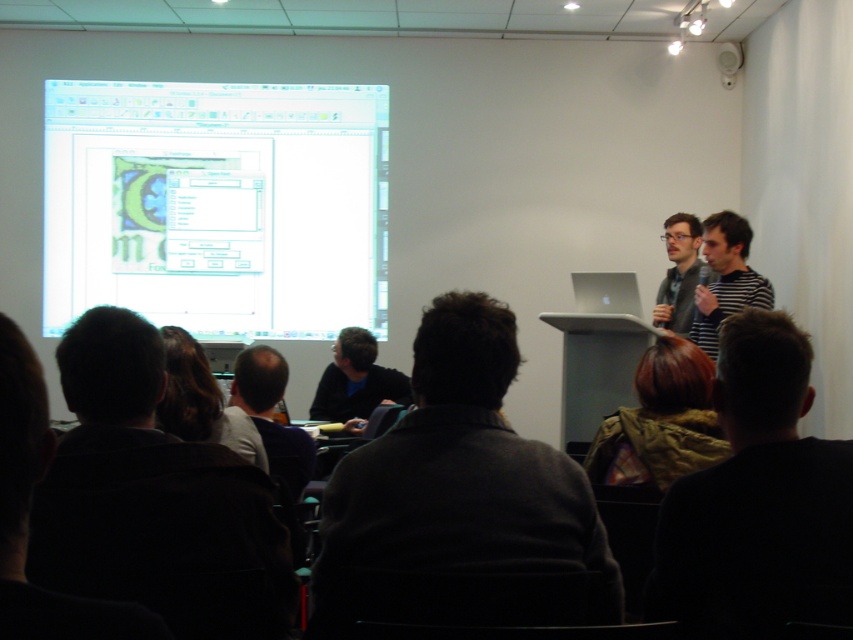
You are an attendee sitting in the front row of the classroom. You notice two presenters at the podium. One is wearing a dark gray sweater at center, and the other is wearing a striped shirt at right. Which presenter is standing closer to the front of the room?

The dark gray sweater at center is positioned under striped shirt at right, meaning the presenter in the dark gray sweater at center is standing closer to the front of the room.

You are an attendee in the classroom and want to ask a question to the presenter. Who should you direct your question to, the dark gray sweater at center or the striped shirt at right?

You should direct your question to the dark gray sweater at center because they are the one speaking into the microphone and likely the main presenter.

You are an attendee in the classroom and want to know which object is smaller between the shiny brown hair at center and the dark blue shirt at center. Can you determine this based on their sizes?

The shiny brown hair at center is smaller than the dark blue shirt at center.